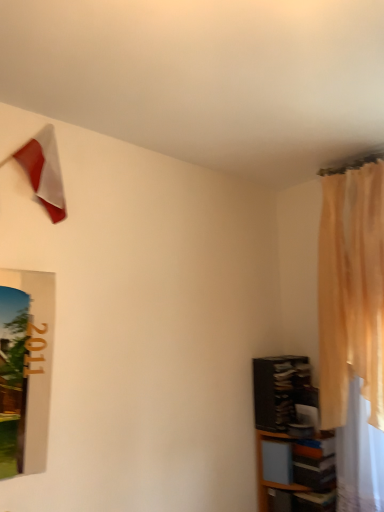
Question: Considering the relative sizes of black glossy shelf at lower right, placed as the 1th shelf when sorted from top to bottom, and wooden shelf at lower right, the 1th shelf from the bottom, in the image provided, is black glossy shelf at lower right, placed as the 1th shelf when sorted from top to bottom, thinner than wooden shelf at lower right, the 1th shelf from the bottom,?

Choices:
 (A) no
 (B) yes

Answer: (A)

Question: Is black glossy shelf at lower right, placed as the 1th shelf when sorted from top to bottom, positioned before wooden shelf at lower right, marked as the second shelf in a top-to-bottom arrangement?

Choices:
 (A) yes
 (B) no

Answer: (B)

Question: Is black glossy shelf at lower right, which is counted as the second shelf, starting from the bottom, facing towards wooden shelf at lower right, marked as the second shelf in a top-to-bottom arrangement?

Choices:
 (A) no
 (B) yes

Answer: (A)

Question: Is black glossy shelf at lower right, placed as the 1th shelf when sorted from top to bottom, smaller than wooden shelf at lower right, marked as the second shelf in a top-to-bottom arrangement?

Choices:
 (A) no
 (B) yes

Answer: (B)

Question: Is black glossy shelf at lower right, which is counted as the second shelf, starting from the bottom, not near wooden shelf at lower right, marked as the second shelf in a top-to-bottom arrangement?

Choices:
 (A) no
 (B) yes

Answer: (A)

Question: Considering the positions of matte red flag at upper left and wooden shelf at lower right, marked as the second shelf in a top-to-bottom arrangement, in the image, is matte red flag at upper left wider or thinner than wooden shelf at lower right, marked as the second shelf in a top-to-bottom arrangement,?

Choices:
 (A) wide
 (B) thin

Answer: (B)

Question: From the image's perspective, is matte red flag at upper left positioned above or below wooden shelf at lower right, the 1th shelf from the bottom?

Choices:
 (A) above
 (B) below

Answer: (A)

Question: From a real-world perspective, is matte red flag at upper left above or below wooden shelf at lower right, marked as the second shelf in a top-to-bottom arrangement?

Choices:
 (A) above
 (B) below

Answer: (A)

Question: Is matte red flag at upper left situated inside wooden shelf at lower right, marked as the second shelf in a top-to-bottom arrangement, or outside?

Choices:
 (A) outside
 (B) inside

Answer: (A)

Question: Is point (382, 204) positioned closer to the camera than point (296, 412)?

Choices:
 (A) farther
 (B) closer

Answer: (B)

Question: Is light beige sheer curtain at right to the left or to the right of black glossy shelf at lower right, placed as the 1th shelf when sorted from top to bottom, in the image?

Choices:
 (A) right
 (B) left

Answer: (A)

Question: Considering the positions of light beige sheer curtain at right and black glossy shelf at lower right, which is counted as the second shelf, starting from the bottom, in the image, is light beige sheer curtain at right taller or shorter than black glossy shelf at lower right, which is counted as the second shelf, starting from the bottom,?

Choices:
 (A) short
 (B) tall

Answer: (B)

Question: In the image, is light beige sheer curtain at right positioned in front of or behind black glossy shelf at lower right, placed as the 1th shelf when sorted from top to bottom?

Choices:
 (A) front
 (B) behind

Answer: (A)

Question: Considering the positions of black glossy shelf at lower right, placed as the 1th shelf when sorted from top to bottom, and wooden shelf at lower right, marked as the second shelf in a top-to-bottom arrangement, in the image, is black glossy shelf at lower right, placed as the 1th shelf when sorted from top to bottom, wider or thinner than wooden shelf at lower right, marked as the second shelf in a top-to-bottom arrangement,?

Choices:
 (A) thin
 (B) wide

Answer: (B)

Question: From the image's perspective, is black glossy shelf at lower right, placed as the 1th shelf when sorted from top to bottom, located above or below wooden shelf at lower right, the 1th shelf from the bottom?

Choices:
 (A) above
 (B) below

Answer: (A)